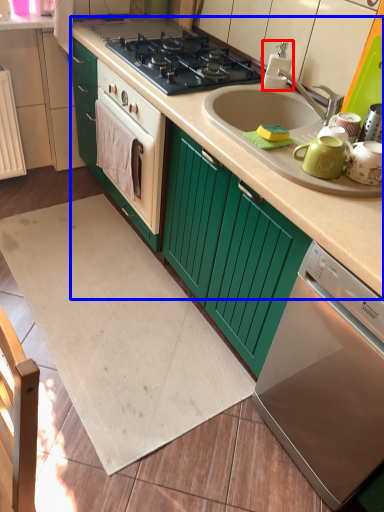
Question: Among these objects, which one is farthest to the camera, appliance (highlighted by a red box) or counter top (highlighted by a blue box)?

Choices:
 (A) appliance
 (B) counter top

Answer: (A)